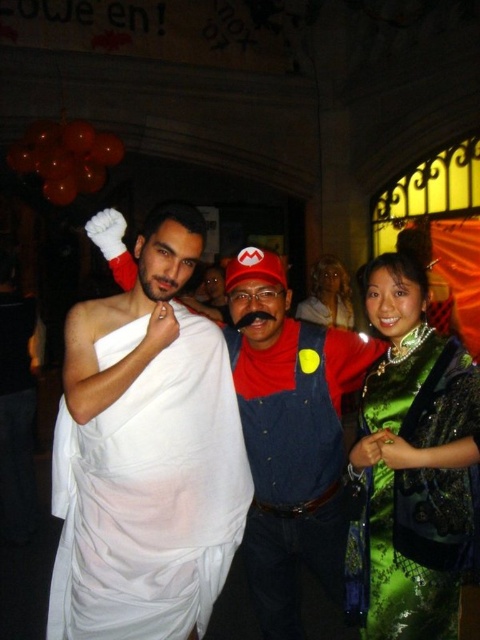
Question: Which point is closer to the camera taking this photo?

Choices:
 (A) (322, 269)
 (B) (458, 372)

Answer: (B)

Question: Among these points, which one is farthest from the camera?

Choices:
 (A) (407, 300)
 (B) (163, 584)

Answer: (B)

Question: Is the position of green satin dress at right more distant than that of shiny gold necklace at center?

Choices:
 (A) yes
 (B) no

Answer: (B)

Question: Which of the following is the farthest from the observer?

Choices:
 (A) (429, 452)
 (B) (175, 577)

Answer: (B)

Question: Does green satin dress at right lie behind shiny gold necklace at center?

Choices:
 (A) yes
 (B) no

Answer: (B)

Question: Is white cloth at center smaller than shiny gold necklace at center?

Choices:
 (A) yes
 (B) no

Answer: (B)